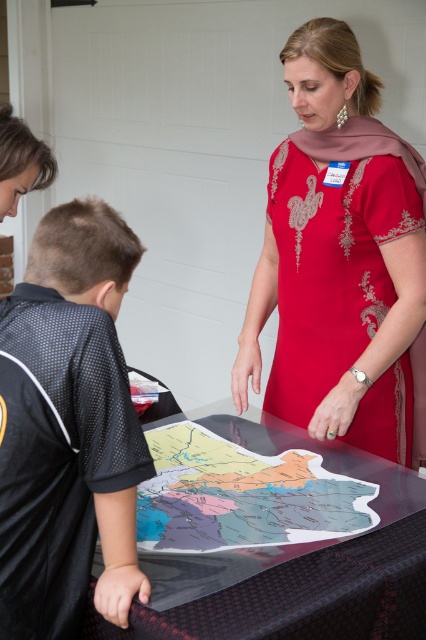
Is black mesh shirt at lower left taller than paper map at center?

Yes, black mesh shirt at lower left is taller than paper map at center.

Can you confirm if black mesh shirt at lower left is wider than paper map at center?

No, black mesh shirt at lower left is not wider than paper map at center.

Which is in front, point (48, 304) or point (175, 499)?

Point (48, 304) is more forward.

I want to click on black mesh shirt at lower left, so click(x=63, y=413).

Does black mesh shirt at lower left have a smaller size compared to red embroidered dress at center?

Correct, black mesh shirt at lower left occupies less space than red embroidered dress at center.

Can you confirm if black mesh shirt at lower left is positioned to the right of red embroidered dress at center?

Incorrect, black mesh shirt at lower left is not on the right side of red embroidered dress at center.

Is point (40, 291) more distant than point (373, 168)?

No, (40, 291) is in front of (373, 168).

This screenshot has width=426, height=640. What are the coordinates of `black mesh shirt at lower left` in the screenshot? It's located at (63, 413).

Can you confirm if red embroidered dress at center is smaller than transparent plastic map at center?

Indeed, red embroidered dress at center has a smaller size compared to transparent plastic map at center.

Identify the location of red embroidered dress at center. This screenshot has width=426, height=640. (333, 256).

Find the location of `red embroidered dress at center`. red embroidered dress at center is located at coordinates (333, 256).